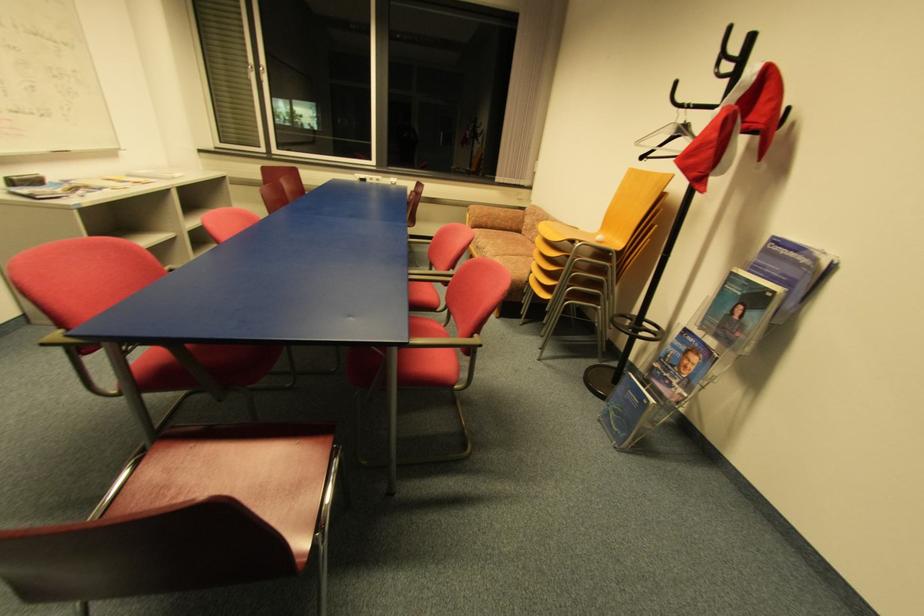
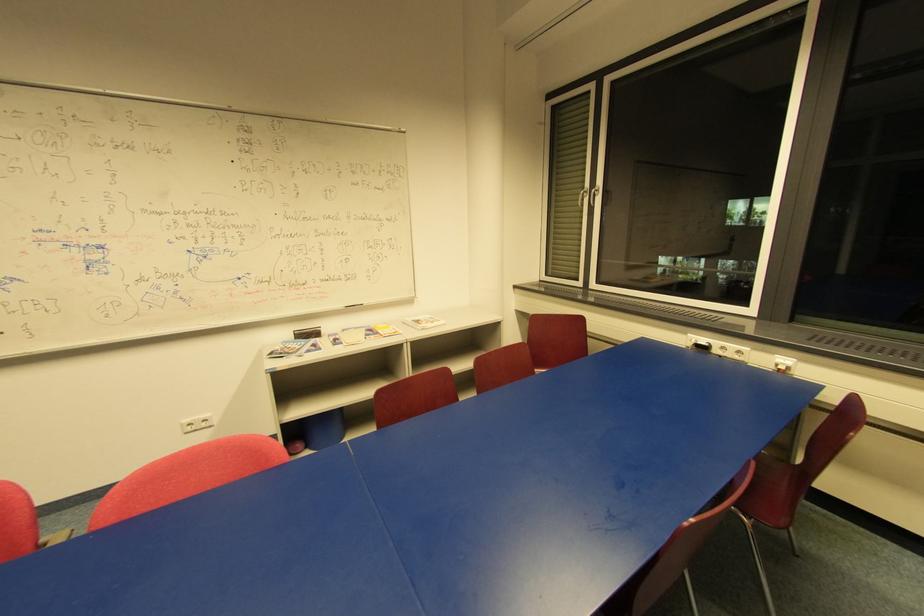
Locate, in the second image, the point that corresponds to [397,185] in the first image.

(785, 369)